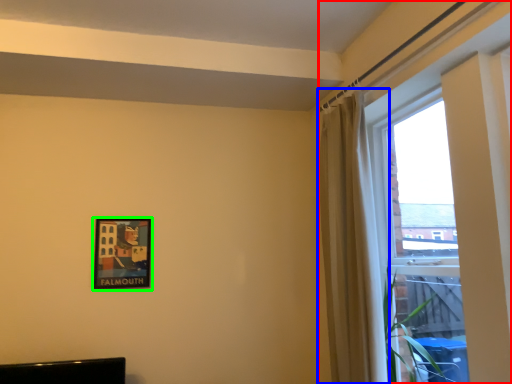
Question: Based on their relative distances, which object is farther from window (highlighted by a red box)? Choose from curtain (highlighted by a blue box) and picture frame (highlighted by a green box).

Choices:
 (A) curtain
 (B) picture frame

Answer: (B)